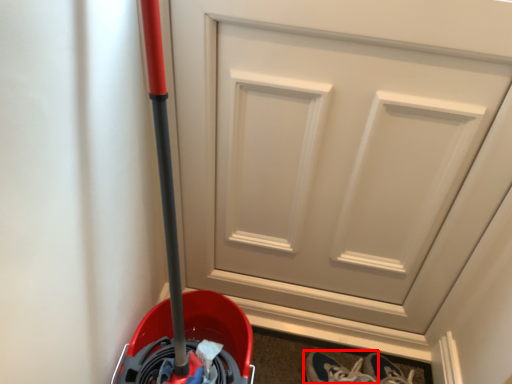
Question: From the image's perspective, what is the correct spatial relationship of footwear (annotated by the red box) in relation to door?

Choices:
 (A) below
 (B) above

Answer: (A)